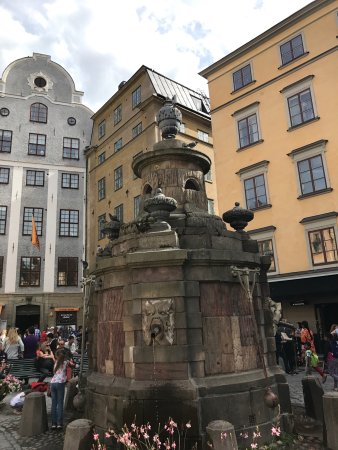
Where is `doorway`? The width and height of the screenshot is (338, 450). doorway is located at coordinates (39, 314).